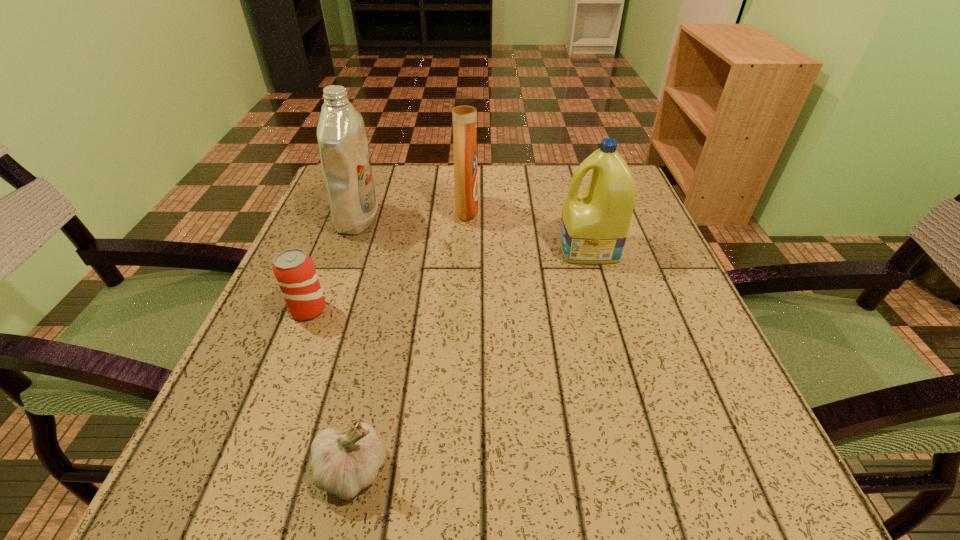
Locate an element on the screen. Image resolution: width=960 pixels, height=540 pixels. vacant space that is in between the fourth farthest object and the second object from right to left is located at coordinates (388, 260).

Where is `vacant area between the beer can and the third object from left to right`? vacant area between the beer can and the third object from left to right is located at coordinates (330, 390).

Identify the location of empty location between the leftmost detergent and the second nearest object. This screenshot has width=960, height=540. (333, 265).

The image size is (960, 540). What are the coordinates of `unoccupied position between the beer can and the third object from right to left` in the screenshot? It's located at (330, 390).

You are a GUI agent. You are given a task and a screenshot of the screen. Output one action in this format:
    pyautogui.click(x=<x>, y=<y>)
    Task: Click on the unoccupied area between the second object from right to left and the beer can
    
    Given the screenshot: What is the action you would take?
    pyautogui.click(x=388, y=260)

Locate an element on the screen. The image size is (960, 540). free space between the third object from right to left and the rightmost object is located at coordinates (470, 359).

Locate an element on the screen. object that ranks as the fourth closest to the nearest object is located at coordinates pyautogui.click(x=464, y=107).

Where is `object that can be found as the third closest to the leftmost detergent`? The height and width of the screenshot is (540, 960). object that can be found as the third closest to the leftmost detergent is located at coordinates (595, 221).

You are a GUI agent. You are given a task and a screenshot of the screen. Output one action in this format:
    pyautogui.click(x=<x>, y=<y>)
    Task: Click on the detergent that is the second closest to the rightmost detergent
    This screenshot has width=960, height=540.
    Given the screenshot: What is the action you would take?
    pyautogui.click(x=345, y=159)

The width and height of the screenshot is (960, 540). Identify the location of the third closest detergent relative to the nearest object. (464, 107).